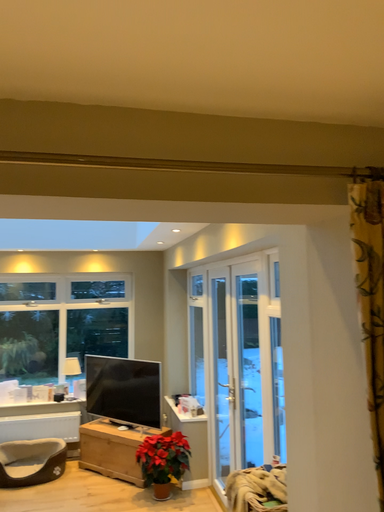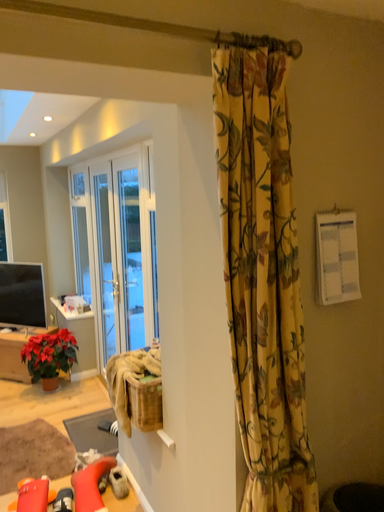
Question: Which way did the camera rotate in the video?

Choices:
 (A) rotated downward
 (B) rotated upward

Answer: (A)